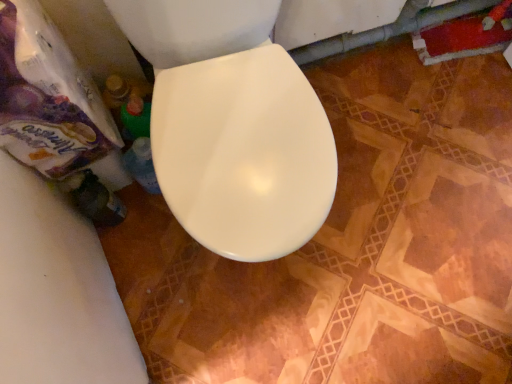
Find the location of a particular element. empty space that is ontop of white glossy toilet seat at center (from a real-world perspective) is located at coordinates (243, 169).